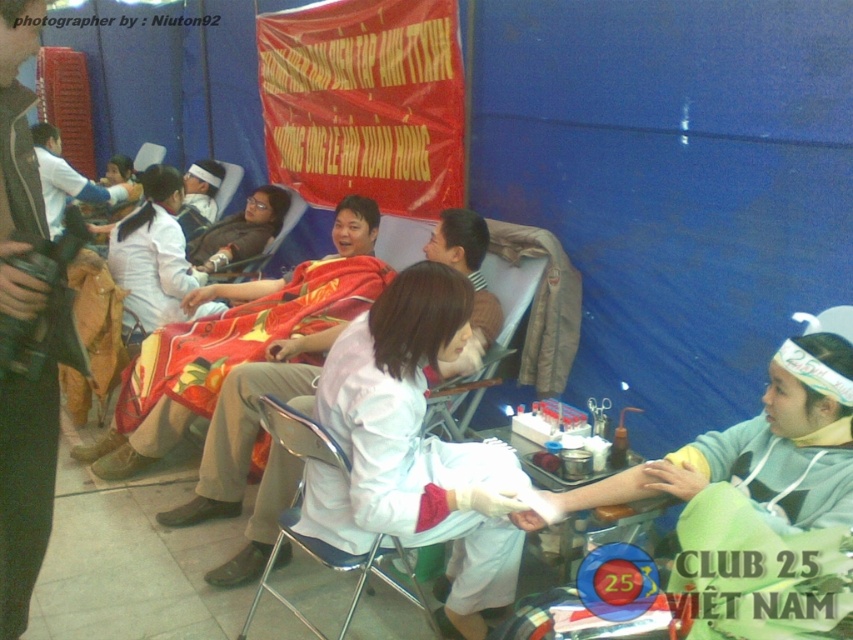
Which is in front, point (32, 317) or point (212, 269)?

Point (32, 317) is in front.

Is white matte coat at center shorter than matte black jacket at center?

No, white matte coat at center is not shorter than matte black jacket at center.

Between point (19, 38) and point (213, 269), which one is positioned in front?

Positioned in front is point (19, 38).

Locate an element on the screen. white matte coat at center is located at coordinates [x=25, y=488].

Looking at this image, can you confirm if matte red blanket at center is shorter than metallic silver chair at center?

No, matte red blanket at center is not shorter than metallic silver chair at center.

Who is more distant from viewer, (223,512) or (245,620)?

Point (223,512)

Which is in front, point (479, 227) or point (344, 625)?

Positioned in front is point (344, 625).

I want to click on matte red blanket at center, so click(242, 429).

Can you confirm if white matte coat at center is smaller than white matte coat at upper left?

Yes, white matte coat at center is smaller than white matte coat at upper left.

Who is more forward, (x=54, y=422) or (x=55, y=184)?

Point (x=54, y=422) is more forward.

Image resolution: width=853 pixels, height=640 pixels. What do you see at coordinates (25, 488) in the screenshot?
I see `white matte coat at center` at bounding box center [25, 488].

This screenshot has height=640, width=853. I want to click on white matte coat at center, so click(x=25, y=488).